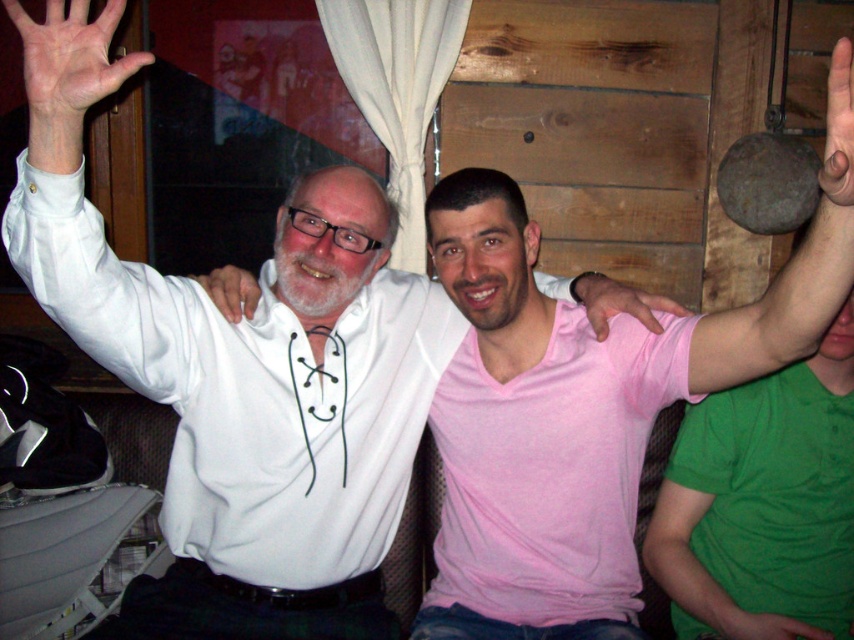
Does white matte hand at upper left have a larger size compared to green matte hand at lower right?

No, white matte hand at upper left is not bigger than green matte hand at lower right.

Does point (21, 90) lie behind point (732, 621)?

That is True.

Identify the location of white matte hand at upper left. (x=9, y=61).

Can you confirm if white matte hand at upper left is positioned to the left of white lace-up shirt at upper center?

Indeed, white matte hand at upper left is positioned on the left side of white lace-up shirt at upper center.

Which is behind, point (13, 92) or point (231, 275)?

The point (13, 92) is more distant.

Where is `white matte hand at upper left`? This screenshot has height=640, width=854. white matte hand at upper left is located at coordinates (9, 61).

Which is below, green cotton shirt at right or pink matte hand at center?

green cotton shirt at right is below.

Is green cotton shirt at right wider than pink matte hand at center?

Correct, the width of green cotton shirt at right exceeds that of pink matte hand at center.

The height and width of the screenshot is (640, 854). What do you see at coordinates (703, 572) in the screenshot?
I see `green cotton shirt at right` at bounding box center [703, 572].

In order to click on green cotton shirt at right in this screenshot , I will do `click(703, 572)`.